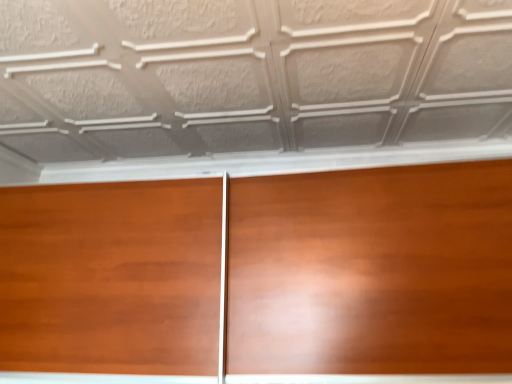
Locate an element on the screen. This screenshot has height=384, width=512. glossy wood door at center is located at coordinates click(x=372, y=271).

Measure the distance between glossy wood door at center and camera.

glossy wood door at center is 4.44 feet away from camera.

What do you see at coordinates (372, 271) in the screenshot? This screenshot has width=512, height=384. I see `glossy wood door at center` at bounding box center [372, 271].

Where is `glossy wood door at center`? The image size is (512, 384). glossy wood door at center is located at coordinates (372, 271).